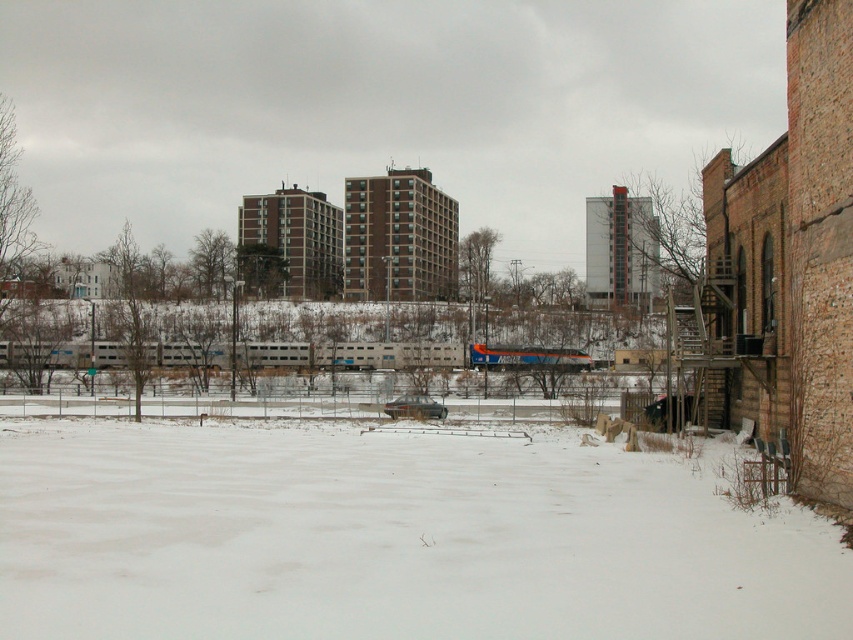
You are a photographer standing in the winter scene and want to capture a closeup shot of the white powdery snow at lower center. Considering your camera can focus on objects within 5 meters, will you be able to take the photo without moving closer?

The white powdery snow at lower center is 6.45 meters away from the camera, which is beyond the 5 meter focus range. Therefore, you cannot take the closeup shot without moving closer.

You are a delivery person trying to reach the brick building on the right. You see the white powdery snow at lower center and the silver metallic train at center. Which object is closer to you as you stand at the starting point?

The white powdery snow at lower center is closer to you because it is in front of the silver metallic train at center.

You are a passenger on the orange metallic train at center and want to see the silver metallic train at center. Can you see it from your current position?

The silver metallic train at center is positioned over the orange metallic train at center, so yes, the passenger can see it from their current position as it is directly above them.